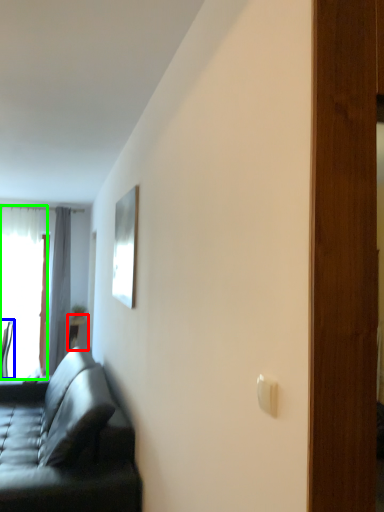
Question: Estimate the real-world distances between objects in this image. Which object is farther from table (highlighted by a red box), chair (highlighted by a blue box) or window (highlighted by a green box)?

Choices:
 (A) chair
 (B) window

Answer: (B)